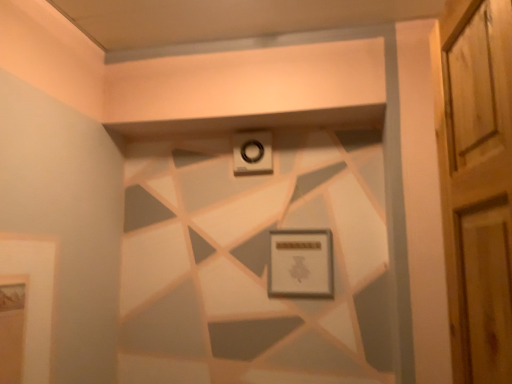
Describe the element at coordinates (301, 264) in the screenshot. I see `matte white picture frame at center` at that location.

Where is `matte white picture frame at center`? The width and height of the screenshot is (512, 384). matte white picture frame at center is located at coordinates (301, 264).

Image resolution: width=512 pixels, height=384 pixels. I want to click on white plastic alarm at upper center, so click(x=253, y=152).

Describe the element at coordinates (253, 152) in the screenshot. I see `white plastic alarm at upper center` at that location.

Find the location of a particular element. matte white picture frame at center is located at coordinates (301, 264).

In the image, is white plastic alarm at upper center on the left side or the right side of matte white picture frame at center?

From the image, it's evident that white plastic alarm at upper center is to the left of matte white picture frame at center.

Between white plastic alarm at upper center and matte white picture frame at center, which one is positioned in front?

matte white picture frame at center is more forward.

Does point (238, 165) appear closer or farther from the camera than point (303, 293)?

Point (238, 165) appears to be farther away from the viewer than point (303, 293).

From the image's perspective, is white plastic alarm at upper center located above or below matte white picture frame at center?

white plastic alarm at upper center is situated higher than matte white picture frame at center in the image.

From a real-world perspective, which object stands above the other?

white plastic alarm at upper center is physically above.

Between white plastic alarm at upper center and matte white picture frame at center, which one has smaller width?

matte white picture frame at center.

Considering the sizes of objects white plastic alarm at upper center and matte white picture frame at center in the image provided, who is taller, white plastic alarm at upper center or matte white picture frame at center?

matte white picture frame at center is taller.

Based on their sizes in the image, would you say white plastic alarm at upper center is bigger or smaller than matte white picture frame at center?

In the image, white plastic alarm at upper center appears to be smaller than matte white picture frame at center.

Looking at this image, is matte white picture frame at center a part of white plastic alarm at upper center?

Actually, matte white picture frame at center is outside white plastic alarm at upper center.

Are white plastic alarm at upper center and matte white picture frame at center located far from each other?

No.

Is white plastic alarm at upper center turned away from matte white picture frame at center?

white plastic alarm at upper center does not have its back to matte white picture frame at center.

Based on the photo, how many degrees apart are the facing directions of white plastic alarm at upper center and matte white picture frame at center?

0.0594 degrees.

Find the location of a particular element. The height and width of the screenshot is (384, 512). picture frame below the white plastic alarm at upper center (from a real-world perspective) is located at coordinates (301, 264).

Which is more to the right, matte white picture frame at center or white plastic alarm at upper center?

matte white picture frame at center is more to the right.

Which object is further away from the camera, matte white picture frame at center or white plastic alarm at upper center?

white plastic alarm at upper center is further from the camera.

Considering the positions of points (302, 293) and (237, 157), is point (302, 293) farther from camera compared to point (237, 157)?

No, (302, 293) is in front of (237, 157).

From the image's perspective, is matte white picture frame at center under white plastic alarm at upper center?

Yes, from the image's perspective, matte white picture frame at center is below white plastic alarm at upper center.

In the scene shown: From a real-world perspective, who is located lower, matte white picture frame at center or white plastic alarm at upper center?

In real-world perspective, matte white picture frame at center is lower.

Does matte white picture frame at center have a lesser width compared to white plastic alarm at upper center?

Yes.

Is matte white picture frame at center shorter than white plastic alarm at upper center?

In fact, matte white picture frame at center may be taller than white plastic alarm at upper center.

Consider the image. Considering the relative sizes of matte white picture frame at center and white plastic alarm at upper center in the image provided, is matte white picture frame at center bigger than white plastic alarm at upper center?

Indeed, matte white picture frame at center has a larger size compared to white plastic alarm at upper center.

Do you think matte white picture frame at center is within white plastic alarm at upper center, or outside of it?

matte white picture frame at center cannot be found inside white plastic alarm at upper center.

Is matte white picture frame at center touching white plastic alarm at upper center?

No, matte white picture frame at center is not beside white plastic alarm at upper center.

Is matte white picture frame at center oriented towards white plastic alarm at upper center?

No, matte white picture frame at center is not turned towards white plastic alarm at upper center.

What's the angular difference between matte white picture frame at center and white plastic alarm at upper center's facing directions?

0.0594 degrees.

Locate an element on the screen. alarm on the left side of matte white picture frame at center is located at coordinates (253, 152).

Where is `picture frame beneath the white plastic alarm at upper center (from a real-world perspective)`? picture frame beneath the white plastic alarm at upper center (from a real-world perspective) is located at coordinates 301,264.

Identify the location of alarm that is on the left side of matte white picture frame at center. (253, 152).